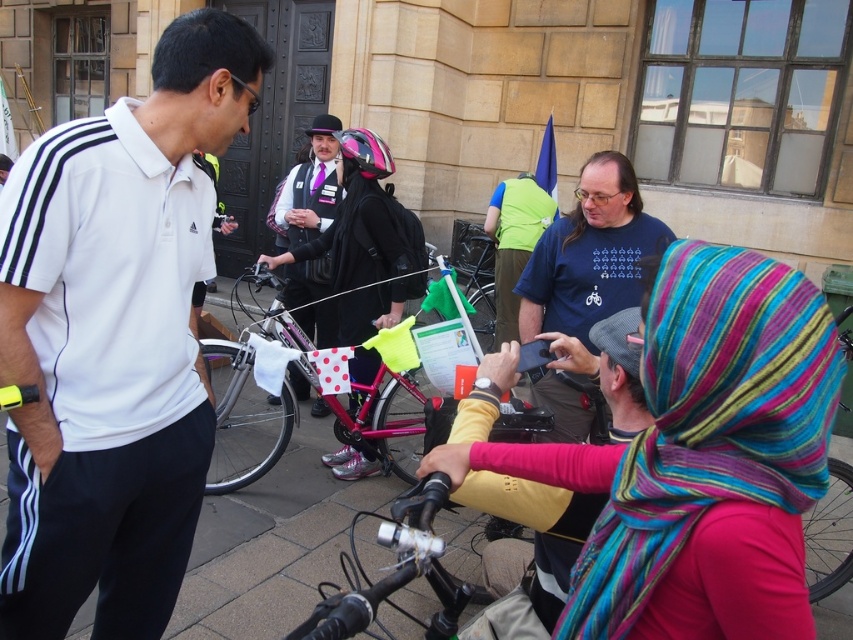
Question: Can you confirm if white matte polo shirt at left is wider than blue cotton t-shirt at upper center?

Choices:
 (A) yes
 (B) no

Answer: (B)

Question: Which point is closer to the camera?

Choices:
 (A) (595, 634)
 (B) (641, 256)
 (C) (247, 368)

Answer: (A)

Question: Which of these objects is positioned closest to the pink matte helmet at center?

Choices:
 (A) pink metallic bicycle at center
 (B) blue cotton t-shirt at upper center

Answer: (A)

Question: In this image, where is white matte polo shirt at left located relative to pink matte helmet at center?

Choices:
 (A) above
 (B) below

Answer: (B)

Question: Which point is closer to the camera?

Choices:
 (A) pink matte helmet at center
 (B) white matte polo shirt at left
 (C) blue cotton t-shirt at upper center
 (D) pink metallic bicycle at center

Answer: (B)

Question: Does white matte polo shirt at left have a lesser width compared to pink matte helmet at center?

Choices:
 (A) yes
 (B) no

Answer: (A)